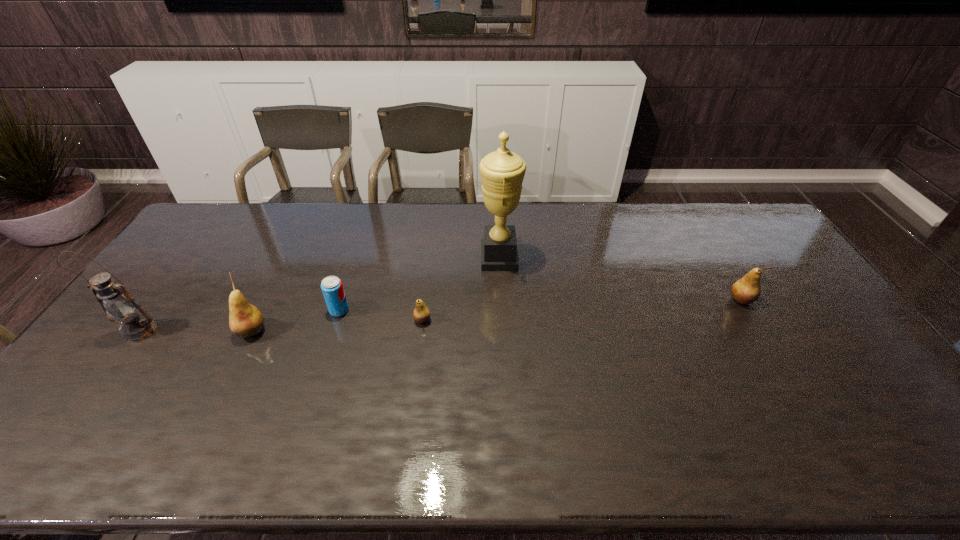
Where is `vacant space that's between the rightmost object and the third object from left to right`? This screenshot has height=540, width=960. vacant space that's between the rightmost object and the third object from left to right is located at coordinates (540, 305).

This screenshot has height=540, width=960. I want to click on vacant region between the farthest object and the shortest pear, so pos(461,289).

Image resolution: width=960 pixels, height=540 pixels. I want to click on vacant area that lies between the fourth tallest object and the second pear from left to right, so click(x=582, y=310).

Find the location of a particular element. Image resolution: width=960 pixels, height=540 pixels. object that is the nearest to the fifth object from left to right is located at coordinates (421, 314).

This screenshot has width=960, height=540. Identify the location of object that is the fourth closest to the fourth tallest object. (245, 320).

Point out which pear is positioned as the nearest to the rightmost pear. Please provide its 2D coordinates. Your answer should be formatted as a tuple, i.e. [(x, y)], where the tuple contains the x and y coordinates of a point satisfying the conditions above.

[(421, 314)]

Select which pear is the second closest to the fourth object from right to left. Please provide its 2D coordinates. Your answer should be formatted as a tuple, i.e. [(x, y)], where the tuple contains the x and y coordinates of a point satisfying the conditions above.

[(421, 314)]

Identify the location of free space that satisfies the following two spatial constraints: 1. on the back side of the soda can; 2. on the left side of the fifth shortest object. (155, 310).

You are a GUI agent. You are given a task and a screenshot of the screen. Output one action in this format:
    pyautogui.click(x=<x>, y=<y>)
    Task: Click on the free spot that satisfies the following two spatial constraints: 1. on the back side of the rightmost object; 2. on the right side of the leftmost object
    
    Given the screenshot: What is the action you would take?
    pyautogui.click(x=162, y=300)